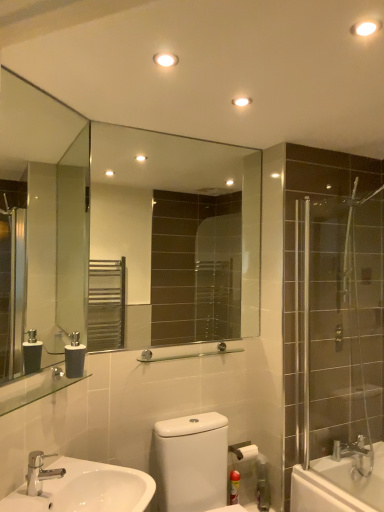
The image size is (384, 512). What are the coordinates of `free space behind chrome metallic faucet at lower left` in the screenshot? It's located at (71, 477).